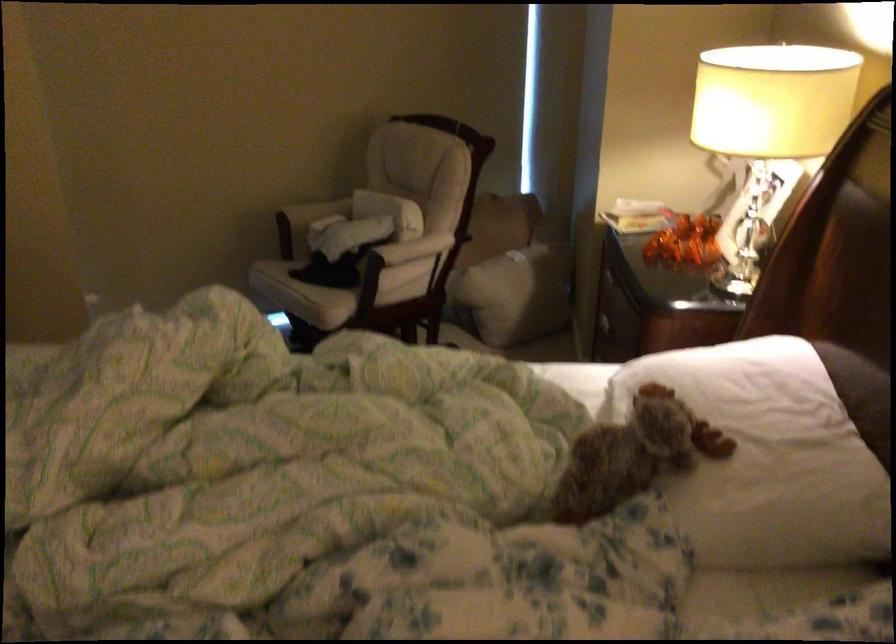
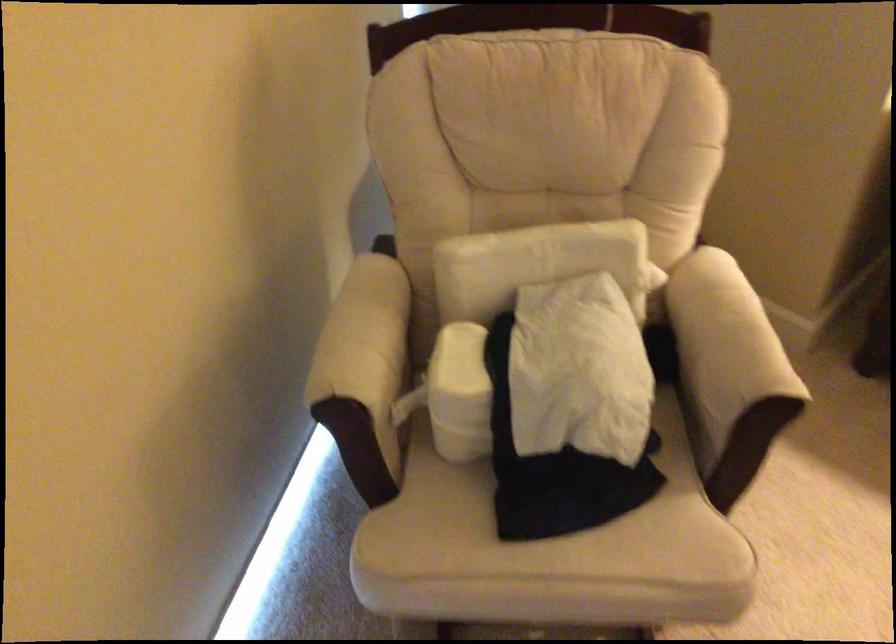
In the second image, find the point that corresponds to (312,223) in the first image.

(460, 393)